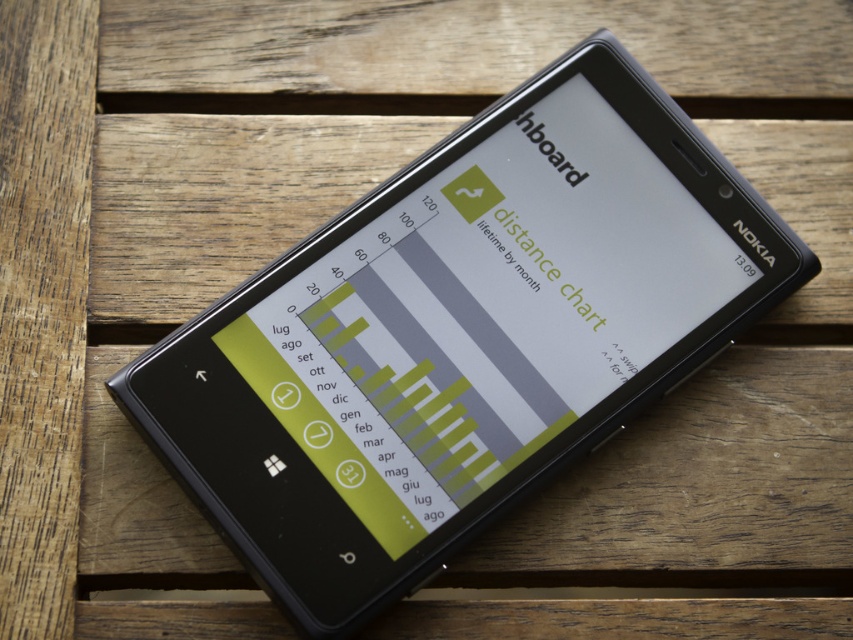
Question: Is matte black phone at center thinner than green matte text at center?

Choices:
 (A) no
 (B) yes

Answer: (A)

Question: Is matte black phone at center positioned before green matte text at center?

Choices:
 (A) yes
 (B) no

Answer: (A)

Question: Among these objects, which one is farthest from the camera?

Choices:
 (A) matte black phone at center
 (B) green matte text at center

Answer: (B)

Question: Does matte black phone at center appear on the left side of green matte text at center?

Choices:
 (A) yes
 (B) no

Answer: (B)